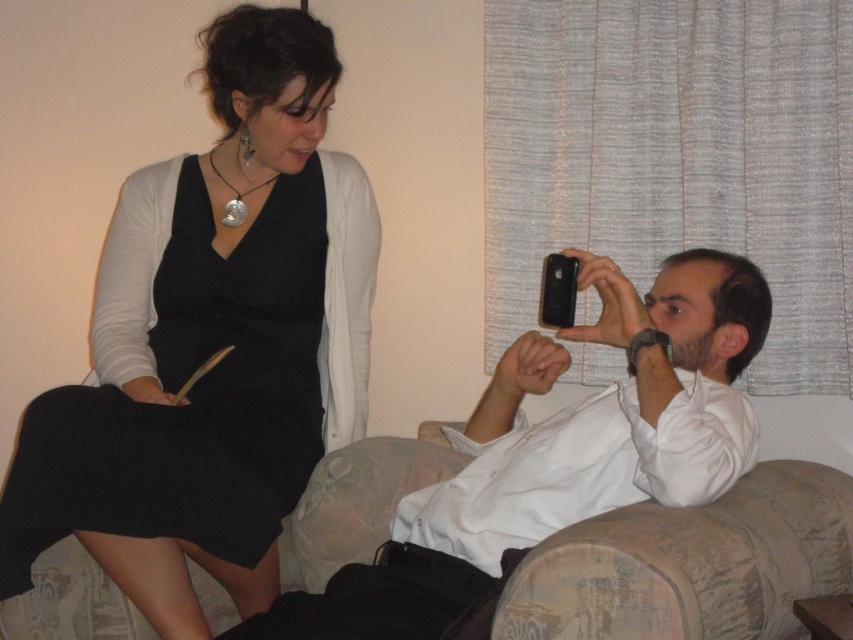
You are standing in the room and want to place a small plant exactly at the point marked by the coordinates point [190,397]. Where would this plant be placed relative to the black matte dress at left?

The point [190,397] marks the location of the black matte dress at left, so placing the plant there would place it directly on the dress.

You are a photographer setting up for a portrait session. You need to ensure that the black matte dress at left and the silver metallic pendant at upper center are both visible in the frame. Based on their positions, which object should you focus on first to capture both in the shot?

The black matte dress at left is to the left of silver metallic pendant at upper center, so you should focus on the silver metallic pendant at upper center first to ensure both objects are in the frame.